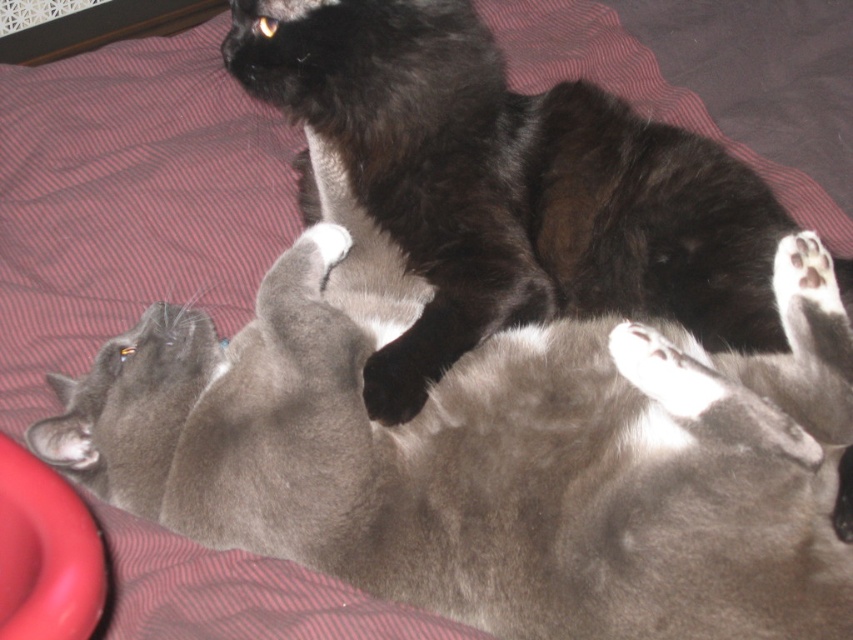
You are a photographer standing at a certain distance from the soft gray cat at center. You want to take a closeup photo of it without disturbing the cats. Since the camera can focus on objects within 30 inches, will you need to move closer or farther away?

The soft gray cat at center is 32.54 inches away from viewer. Since the camera can focus within 30 inches, you need to move closer to get within 30 inches to take the closeup photo.

You are taking a photo of two cats on a striped couch. You want to focus on the cat that is closer to the camera. Which point should you focus on, point 1 at coordinates point [512,378] or point 2 at coordinates point [463,138]?

Point 1 at coordinates point [512,378] is closer to the camera than point 2 at coordinates point [463,138], so you should focus on point 1 at coordinates point [512,378].

You are a photographer trying to capture a photo of the soft gray cat at center and the black fluffy cat at upper center. If you want to ensure both cats are in focus, which cat should you focus on first, the one closer to you or the one further away?

To ensure both cats are in focus, you should focus on the cat closer to you first. Since the soft gray cat at center is below the black fluffy cat at upper center, the gray cat is closer. By focusing on the closer cat, you can achieve a greater depth of field to include the farther cat in focus as well.